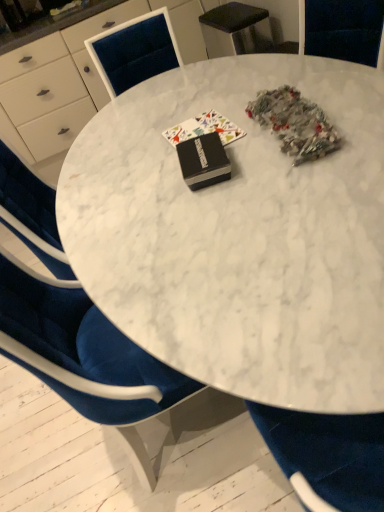
Question: Looking at their shapes, would you say black matte book at center, which appears as the first book when viewed from the back, is wider or thinner than black matte book at center, placed as the 1th book when sorted from front to back?

Choices:
 (A) wide
 (B) thin

Answer: (A)

Question: Considering the positions of point (173, 128) and point (205, 141), is point (173, 128) closer or farther from the camera than point (205, 141)?

Choices:
 (A) closer
 (B) farther

Answer: (B)

Question: Estimate the real-world distances between objects in this image. Which object is closer to the black matte book at center, which is counted as the 2th book, starting from the front?

Choices:
 (A) white marble table at center
 (B) black matte book at center, which ranks as the second book in back-to-front order
 (C) white marble table at center

Answer: (B)

Question: Which object is the closest to the white marble table at center?

Choices:
 (A) white marble table at center
 (B) black matte book at center, placed as the 1th book when sorted from front to back
 (C) black matte book at center, which is counted as the 2th book, starting from the front

Answer: (C)